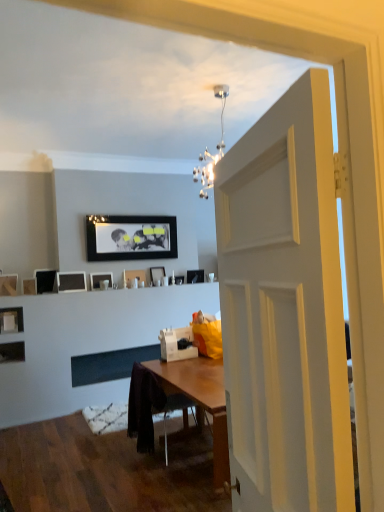
Where is `blank space to the left of wooden chair at center`? blank space to the left of wooden chair at center is located at coordinates (114, 462).